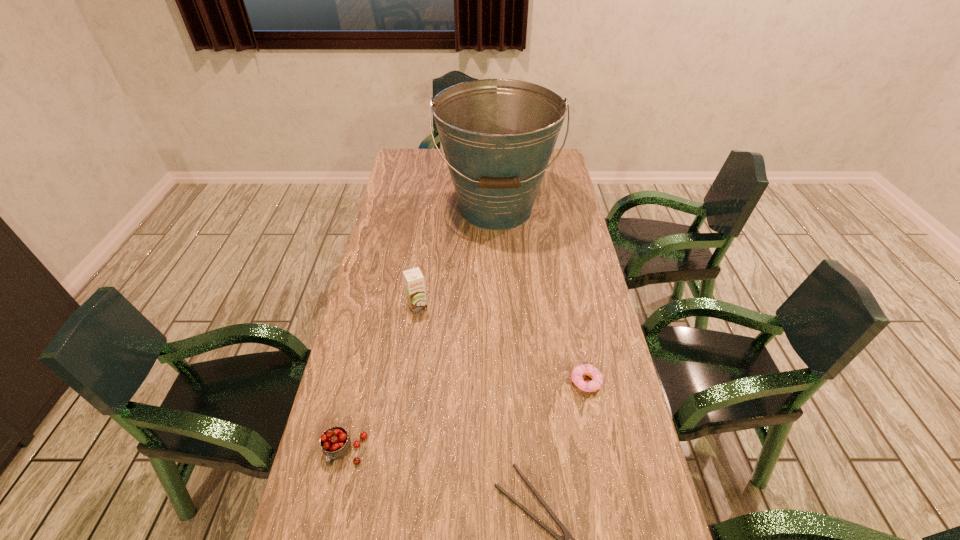
Identify the location of free space located on the handle side of the cherry. This screenshot has width=960, height=540. (328, 524).

Locate an element on the screen. This screenshot has width=960, height=540. free space located 0.220m on the left of the second shortest object is located at coordinates (485, 382).

In order to click on chocolate milk that is at the left edge in this screenshot , I will do `click(414, 281)`.

I want to click on cherry located in the left edge section of the desktop, so click(335, 442).

Locate an element on the screen. The width and height of the screenshot is (960, 540). bucket at the right edge is located at coordinates (498, 135).

Locate an element on the screen. The image size is (960, 540). doughnut that is at the right edge is located at coordinates (584, 369).

Locate an element on the screen. Image resolution: width=960 pixels, height=540 pixels. free space at the far edge of the desktop is located at coordinates (448, 173).

This screenshot has height=540, width=960. I want to click on blank space at the left edge of the desktop, so click(362, 366).

Where is `blank space at the right edge of the desktop`? This screenshot has width=960, height=540. blank space at the right edge of the desktop is located at coordinates (550, 205).

In the image, there is a desktop. What are the coordinates of `vacant space at the far left corner` in the screenshot? It's located at (433, 169).